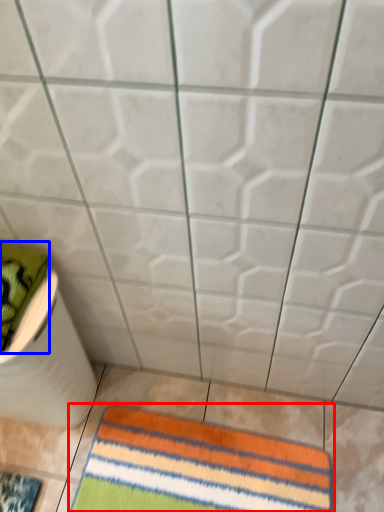
Question: Which of the following is the closest to the observer, towel (highlighted by a red box) or beach towel (highlighted by a blue box)?

Choices:
 (A) towel
 (B) beach towel

Answer: (B)